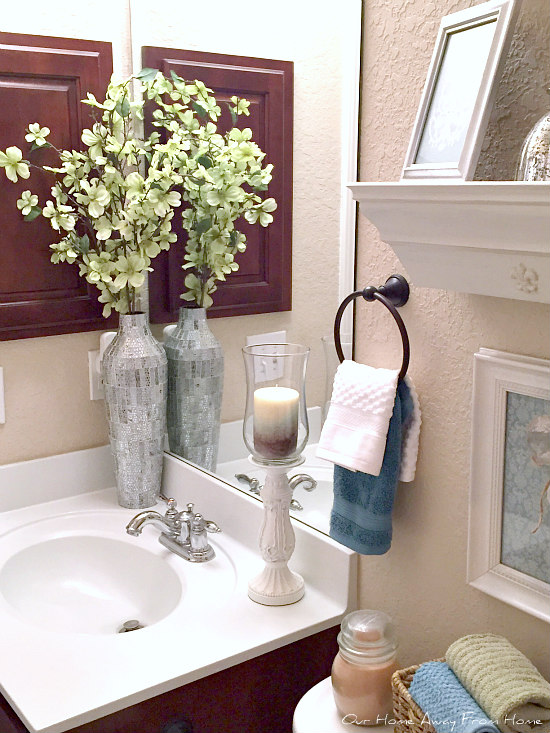
You are a GUI agent. You are given a task and a screenshot of the screen. Output one action in this format:
    pyautogui.click(x=<x>, y=<y>)
    Task: Click on the picture frame
    Image resolution: width=550 pixels, height=733 pixels.
    Given the screenshot: What is the action you would take?
    pyautogui.click(x=432, y=174), pyautogui.click(x=486, y=581)